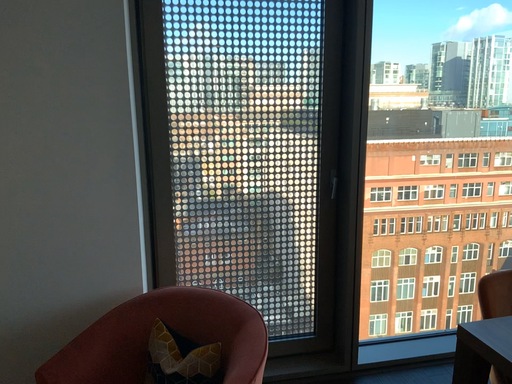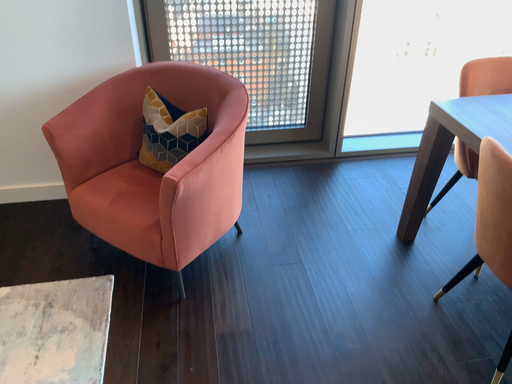
Question: How did the camera likely rotate when shooting the video?

Choices:
 (A) rotated upward
 (B) rotated downward

Answer: (B)